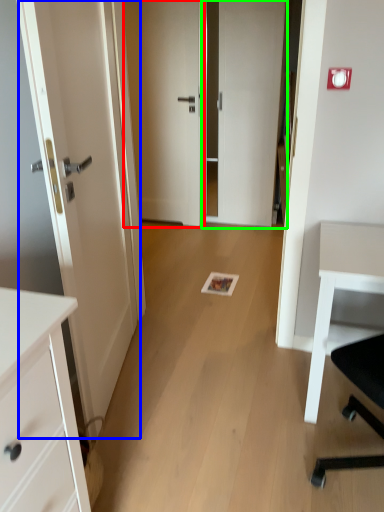
Question: Which is farther away from door (highlighted by a red box)? door (highlighted by a blue box) or door (highlighted by a green box)?

Choices:
 (A) door
 (B) door

Answer: (A)